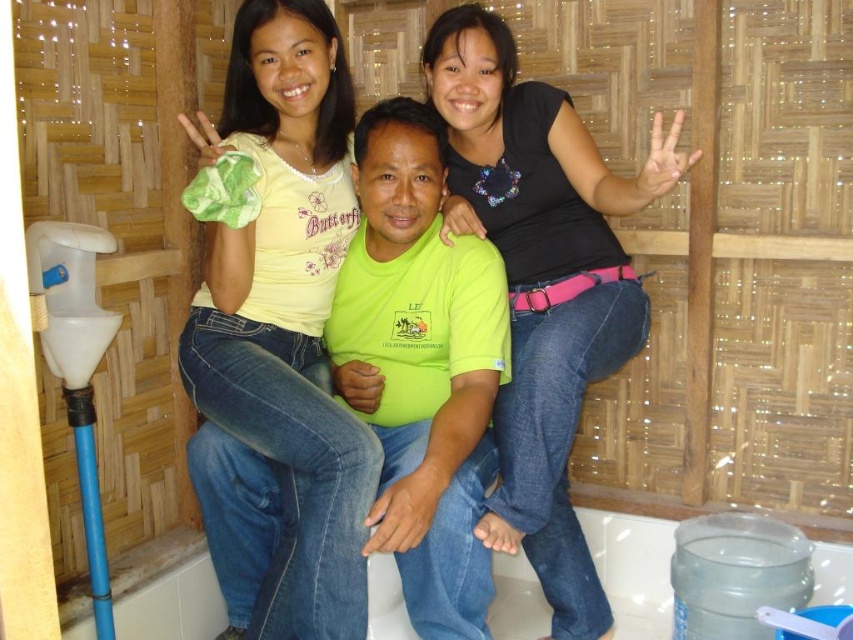
Between point (352, 115) and point (653, 163), which one is positioned in front?

Point (653, 163)

Which of these two, matte yellow shirt at upper left or black matte shirt at center, stands shorter?

black matte shirt at center is shorter.

You are a GUI agent. You are given a task and a screenshot of the screen. Output one action in this format:
    pyautogui.click(x=<x>, y=<y>)
    Task: Click on the matte yellow shirt at upper left
    Image resolution: width=853 pixels, height=640 pixels.
    Given the screenshot: What is the action you would take?
    pyautogui.click(x=283, y=308)